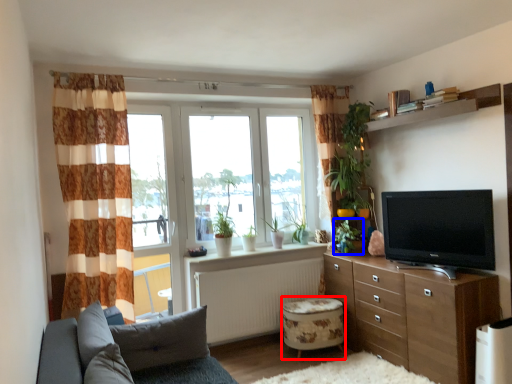
Question: Which object is closer to the camera taking this photo, stool (highlighted by a red box) or plant (highlighted by a blue box)?

Choices:
 (A) stool
 (B) plant

Answer: (A)